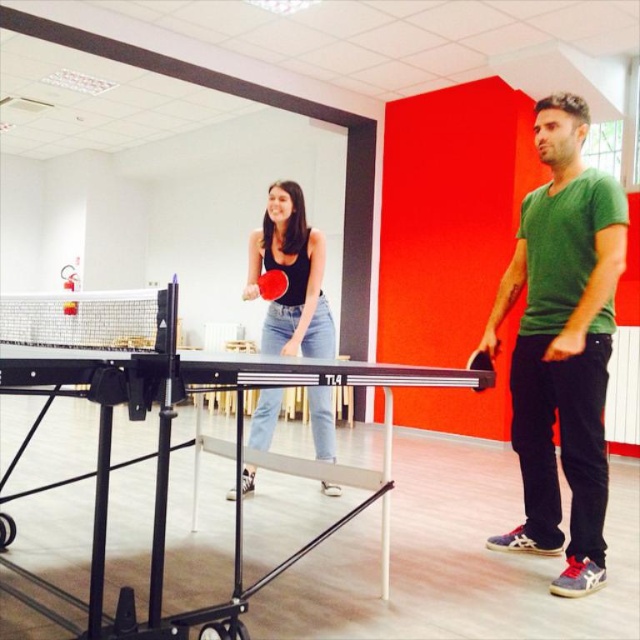
Based on the photo, you are a spectator standing near the ping pong table and want to pick up the closest paddle to you. Which paddle should you choose between the black matte ping pong paddle at center and the rubber paddle at center?

The black matte ping pong paddle at center is closer to the viewer than the rubber paddle at center, so you should choose the black matte ping pong paddle at center.